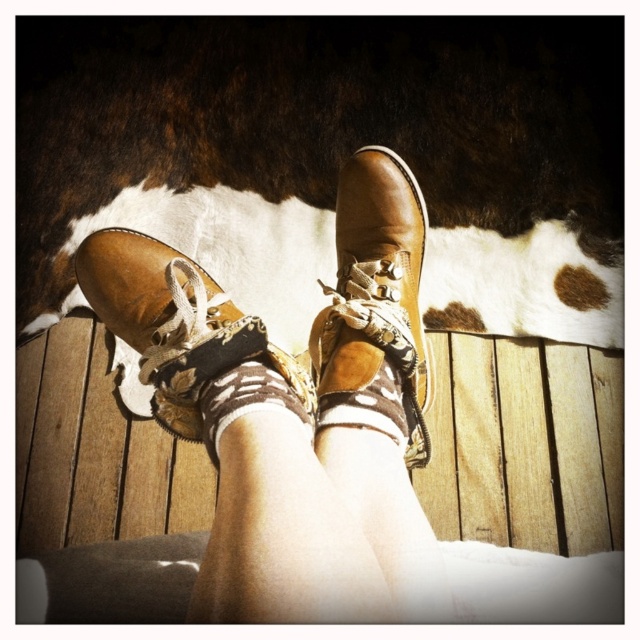
You are designing a shoe organizer and need to know if the leather boots at center can fit into a compartment designed for the brown suede socks at center. Based on the scene description, can the boots fit?

The leather boots at center might be wider than brown suede socks at center, so there is a possibility they won not fit properly in the compartment designed for the socks.

You are trying to determine if the leather boots at center can fully cover the brown suede socks at center based on their heights. Can they?

The leather boots at center are taller than the brown suede socks at center, so yes, the leather boots at center can fully cover the brown suede socks at center.

From the picture: You are trying to decide whether to wear the leather boots at center or the brown suede socks at center for an outdoor walk. Considering their sizes, which one might be more comfortable for walking long distances?

The leather boots at center is larger in size than the brown suede socks at center, so the leather boots at center might be more comfortable for walking long distances as they provide better support and protection.